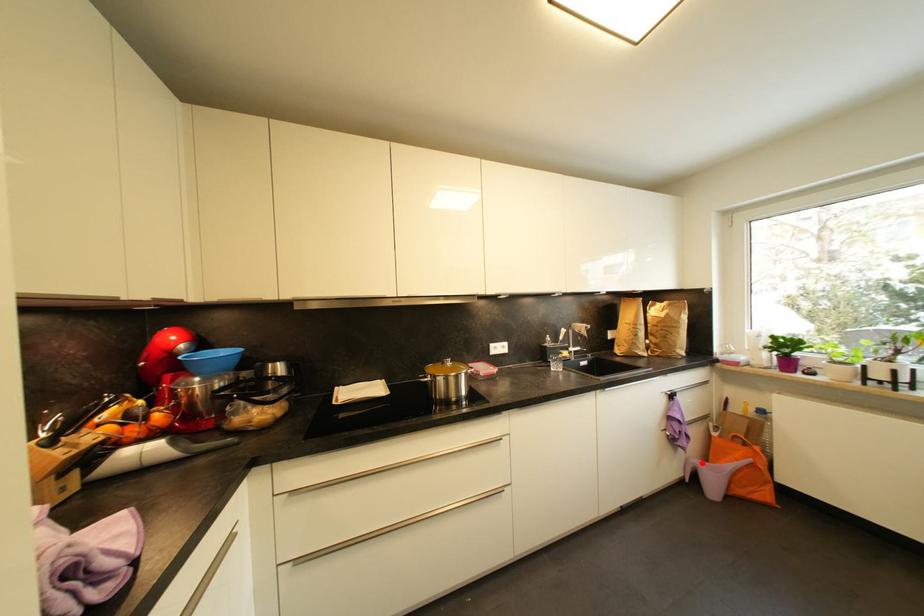
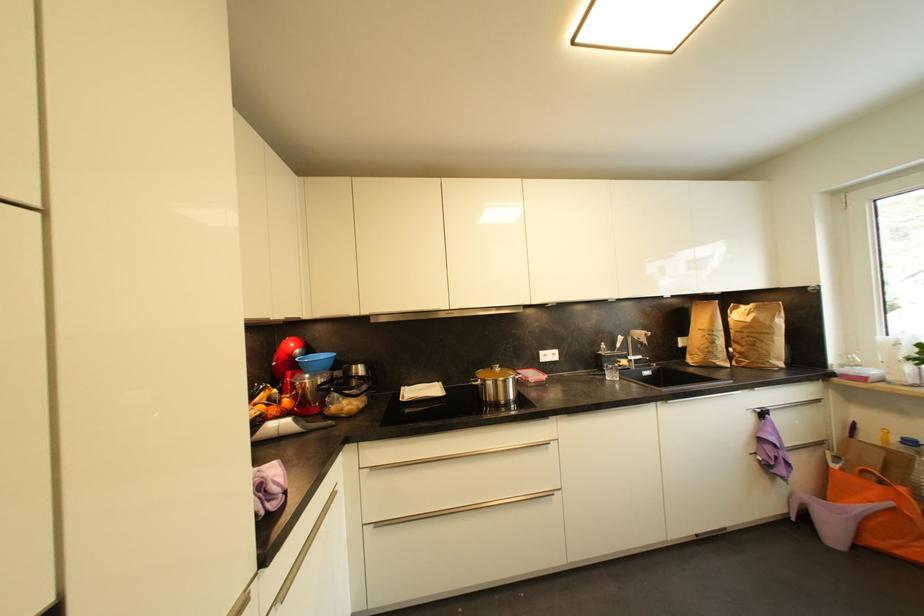
Question: I am providing you with two images of the same scene from different viewpoints. Given a red point in image1, look at the same physical point in image2. Is it:

Choices:
 (A) Closer to the viewpoint
 (B) Farther from the viewpoint

Answer: (A)